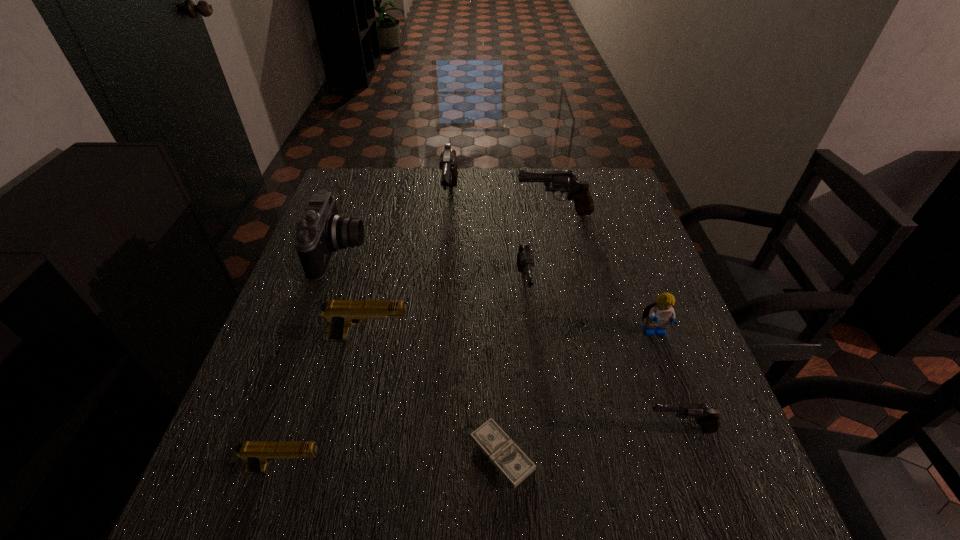
Identify the location of empty space between the tallest object and the camera. This screenshot has height=540, width=960. (396, 227).

Find the location of a particular element. free spot between the third farthest pistol and the tallest object is located at coordinates (487, 245).

Identify the location of free spot between the tallest pistol and the camera. (396, 227).

Find the location of a particular element. The width and height of the screenshot is (960, 540). vacant region between the second nearest gray pistol and the fifth shortest pistol is located at coordinates (540, 250).

Where is `free space between the second nearest gray pistol and the camera`? The image size is (960, 540). free space between the second nearest gray pistol and the camera is located at coordinates (432, 269).

At what (x,y) coordinates should I click in order to perform the action: click on free space between the fourth farthest pistol and the biggest gray pistol. Please return your answer as a coordinate pair (x, y). Looking at the image, I should click on (410, 270).

Identify the location of unoccupied area between the biggest gray pistol and the smaller tan pistol. This screenshot has height=540, width=960. (369, 335).

The height and width of the screenshot is (540, 960). I want to click on vacant area that lies between the second tallest pistol and the fourth nearest pistol, so click(x=540, y=250).

Identify which object is the fifth nearest to the bigger tan pistol. Please provide its 2D coordinates. Your answer should be formatted as a tuple, i.e. [(x, y)], where the tuple contains the x and y coordinates of a point satisfying the conditions above.

[(448, 165)]

Identify the location of object that is the eighth closest one to the camera. The image size is (960, 540). (708, 417).